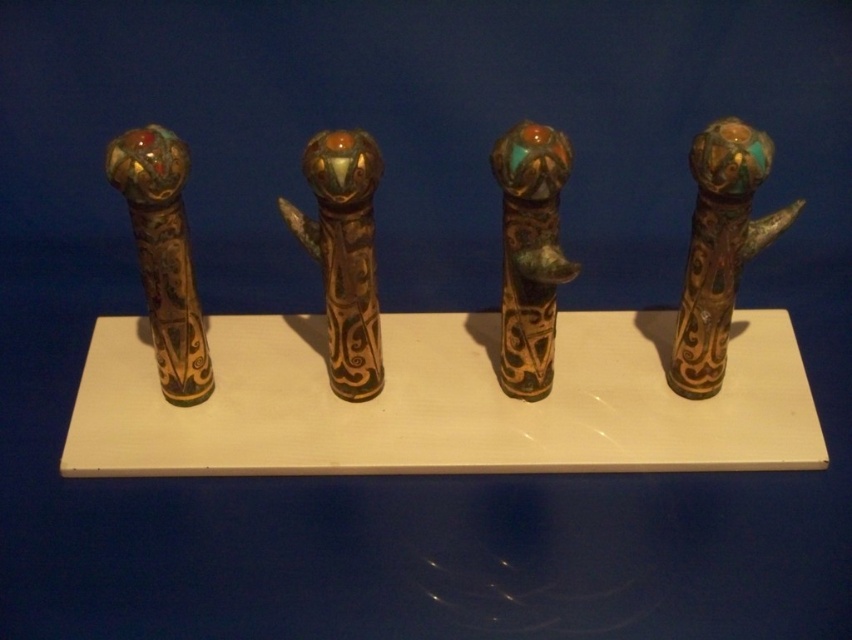
Based on the photo, does gold patina staff at right appear on the left side of glossy bronze staff at center?

In fact, gold patina staff at right is to the right of glossy bronze staff at center.

Locate an element on the screen. The image size is (852, 640). gold patina staff at right is located at coordinates (718, 248).

Is glossy bronze staff at center to the left of gold-bronze staff at left from the viewer's perspective?

In fact, glossy bronze staff at center is to the right of gold-bronze staff at left.

Is glossy bronze staff at center in front of gold-bronze staff at left?

No.

What do you see at coordinates (344, 253) in the screenshot? I see `glossy bronze staff at center` at bounding box center [344, 253].

In order to click on glossy bronze staff at center in this screenshot , I will do `click(344, 253)`.

The height and width of the screenshot is (640, 852). What are the coordinates of `glossy bronze staff at center` in the screenshot? It's located at (344, 253).

Between glossy bronze staff at center and green patinated metal staff at center, which one appears on the left side from the viewer's perspective?

glossy bronze staff at center

Measure the distance between glossy bronze staff at center and camera.

They are 1.07 meters apart.

Locate an element on the screen. This screenshot has height=640, width=852. glossy bronze staff at center is located at coordinates (344, 253).